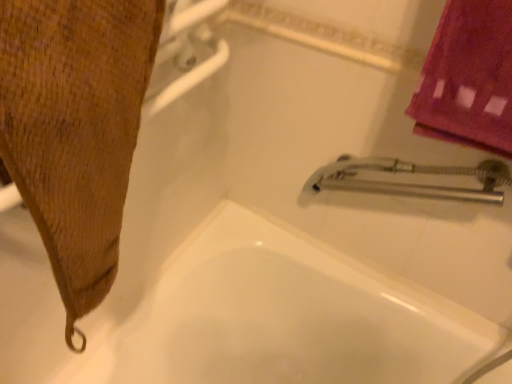
Question: Considering the positions of brown textured towel at left and white glossy bathtub at center in the image, is brown textured towel at left taller or shorter than white glossy bathtub at center?

Choices:
 (A) tall
 (B) short

Answer: (B)

Question: Would you say brown textured towel at left is to the left or to the right of white glossy bathtub at center in the picture?

Choices:
 (A) right
 (B) left

Answer: (B)

Question: From a real-world perspective, relative to white glossy bathtub at center, is brown textured towel at left vertically above or below?

Choices:
 (A) below
 (B) above

Answer: (B)

Question: Visually, is white glossy bathtub at center positioned to the left or to the right of brown textured towel at left?

Choices:
 (A) left
 (B) right

Answer: (B)

Question: From a real-world perspective, is white glossy bathtub at center positioned above or below brown textured towel at left?

Choices:
 (A) below
 (B) above

Answer: (A)

Question: From the image's perspective, is white glossy bathtub at center located above or below brown textured towel at left?

Choices:
 (A) below
 (B) above

Answer: (A)

Question: Relative to brown textured towel at left, is white glossy bathtub at center in front or behind?

Choices:
 (A) front
 (B) behind

Answer: (B)